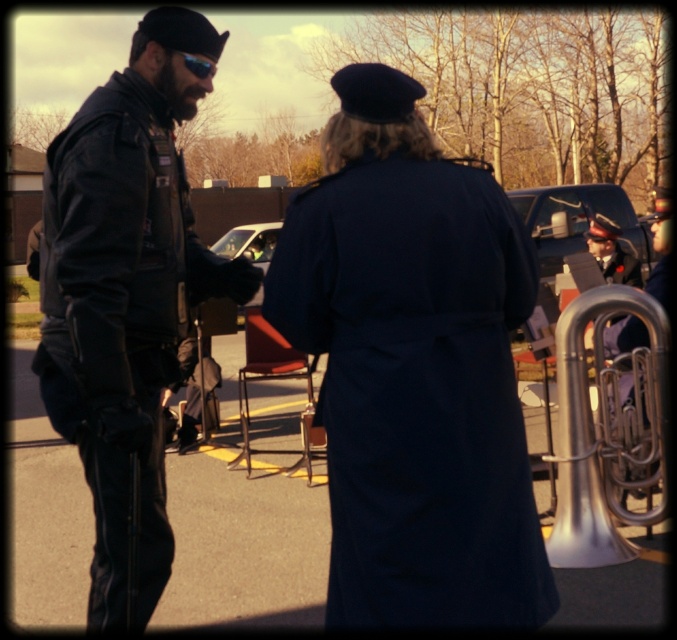
You are a photographer positioned at the camera location. You want to capture a closeup shot of the navy wool coat at center. Given that your camera has a minimum focusing distance of 2 meters, can you achieve this without moving closer?

The navy wool coat at center is 2.94 meters away from the camera. Since the minimum focusing distance is 2 meters, the camera can focus on the navy wool coat at center as it is within range.

You are a photographer positioned at the center of the scene. You want to capture both the leather jacket at left and the silver metallic tuba at lower right in a single frame. Given that your camera has a maximum focal length that allows a field of view covering 2 meters, will you be able to include both objects in the photo?

The distance between the leather jacket at left and the silver metallic tuba at lower right is 2.46 meters. Since the camera can only cover 2 meters, the photographer will not be able to include both objects in the photo without moving closer or adjusting the focal length.